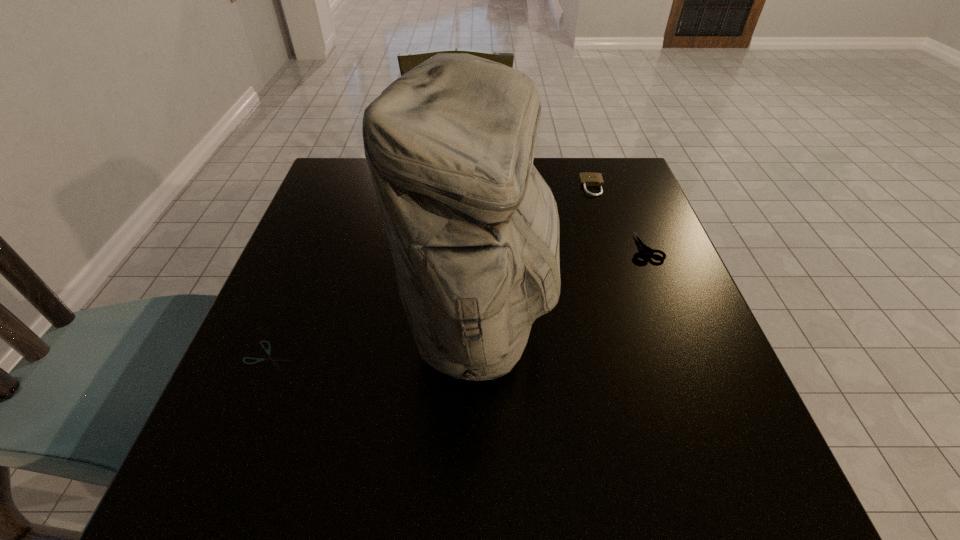
In order to click on backpack in this screenshot , I will do `click(473, 228)`.

What are the coordinates of `the tallest object` in the screenshot? It's located at (473, 228).

At what (x,y) coordinates should I click in order to perform the action: click on the farthest object. Please return your answer as a coordinate pair (x, y). Looking at the image, I should click on (587, 178).

This screenshot has width=960, height=540. I want to click on the third shortest object, so click(x=587, y=178).

Where is `the right shears`? Image resolution: width=960 pixels, height=540 pixels. the right shears is located at coordinates (644, 249).

The height and width of the screenshot is (540, 960). In order to click on the farther shears in this screenshot , I will do `click(644, 249)`.

This screenshot has height=540, width=960. Find the location of `the leftmost object`. the leftmost object is located at coordinates (270, 358).

Find the location of `the shortest object`. the shortest object is located at coordinates (270, 358).

Identify the location of free space located 0.090m on the front-facing side of the backpack. The height and width of the screenshot is (540, 960). 599,324.

Identify the location of vacant position located 0.280m on the front of the padlock. The image size is (960, 540). (619, 272).